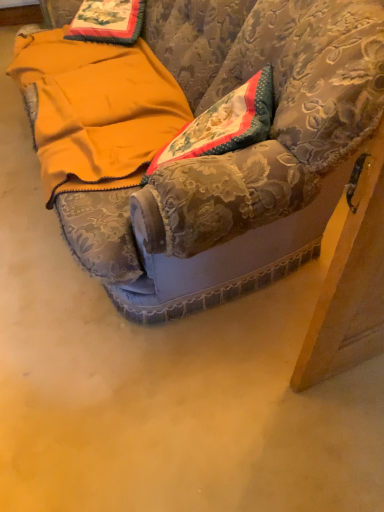
I want to click on yellow fleece blanket at lower left, so click(x=96, y=110).

This screenshot has height=512, width=384. Describe the element at coordinates (96, 110) in the screenshot. I see `yellow fleece blanket at lower left` at that location.

Describe the element at coordinates (240, 152) in the screenshot. I see `velvet couch at center` at that location.

Locate an element on the screen. velvet couch at center is located at coordinates (240, 152).

What is the approximate height of velvet couch at center?

The height of velvet couch at center is 96.11 centimeters.

This screenshot has width=384, height=512. In order to click on yellow fleece blanket at lower left in this screenshot , I will do `click(96, 110)`.

Does velvet couch at center appear on the left side of yellow fleece blanket at lower left?

No, velvet couch at center is not to the left of yellow fleece blanket at lower left.

From the picture: Is the position of velvet couch at center less distant than that of yellow fleece blanket at lower left?

A: Yes, the depth of velvet couch at center is less than that of yellow fleece blanket at lower left.

Does point (284, 73) lie in front of point (81, 100)?

Yes, it is in front of point (81, 100).

From the image's perspective, is velvet couch at center under yellow fleece blanket at lower left?

No, from the image's perspective, velvet couch at center is not beneath yellow fleece blanket at lower left.

From a real-world perspective, relative to yellow fleece blanket at lower left, is velvet couch at center vertically above or below?

velvet couch at center is situated higher than yellow fleece blanket at lower left in the real world.

Does velvet couch at center have a lesser width compared to yellow fleece blanket at lower left?

No.

Considering the sizes of objects velvet couch at center and yellow fleece blanket at lower left in the image provided, who is taller, velvet couch at center or yellow fleece blanket at lower left?

velvet couch at center is taller.

Considering the sizes of objects velvet couch at center and yellow fleece blanket at lower left in the image provided, who is bigger, velvet couch at center or yellow fleece blanket at lower left?

With larger size is velvet couch at center.

Is velvet couch at center completely or partially outside of yellow fleece blanket at lower left?

velvet couch at center is positioned outside yellow fleece blanket at lower left.

Are velvet couch at center and yellow fleece blanket at lower left located far from each other?

velvet couch at center is actually quite close to yellow fleece blanket at lower left.

Does velvet couch at center turn towards yellow fleece blanket at lower left?

Yes, velvet couch at center is facing yellow fleece blanket at lower left.

How many degrees apart are the facing directions of velvet couch at center and yellow fleece blanket at lower left?

2.55 degrees separate the facing orientations of velvet couch at center and yellow fleece blanket at lower left.

Locate an element on the screen. The width and height of the screenshot is (384, 512). furniture that is above the yellow fleece blanket at lower left (from a real-world perspective) is located at coordinates (240, 152).

Which is more to the left, yellow fleece blanket at lower left or velvet couch at center?

Positioned to the left is yellow fleece blanket at lower left.

Between yellow fleece blanket at lower left and velvet couch at center, which one is positioned in front?

velvet couch at center.

Is point (53, 138) less distant than point (213, 74)?

Yes.

From the image's perspective, would you say yellow fleece blanket at lower left is shown under velvet couch at center?

Yes, from the image's perspective, yellow fleece blanket at lower left is beneath velvet couch at center.

From a real-world perspective, relative to velvet couch at center, is yellow fleece blanket at lower left vertically above or below?

yellow fleece blanket at lower left is situated lower than velvet couch at center in the real world.

Does yellow fleece blanket at lower left have a lesser width compared to velvet couch at center?

Correct, the width of yellow fleece blanket at lower left is less than that of velvet couch at center.

Who is taller, yellow fleece blanket at lower left or velvet couch at center?

With more height is velvet couch at center.

In terms of size, does yellow fleece blanket at lower left appear bigger or smaller than velvet couch at center?

Clearly, yellow fleece blanket at lower left is smaller in size than velvet couch at center.

Is yellow fleece blanket at lower left situated inside velvet couch at center or outside?

yellow fleece blanket at lower left exists entirely within velvet couch at center.

Are yellow fleece blanket at lower left and velvet couch at center beside each other?

No.

Is yellow fleece blanket at lower left positioned with its back to velvet couch at center?

Yes, yellow fleece blanket at lower left is facing away from velvet couch at center.

Based on the photo, measure the distance from yellow fleece blanket at lower left to velvet couch at center.

32.89 centimeters.

Identify the location of furniture that appears above the yellow fleece blanket at lower left (from a real-world perspective). This screenshot has height=512, width=384. (240, 152).

This screenshot has width=384, height=512. Identify the location of blanket that appears below the velvet couch at center (from the image's perspective). (96, 110).

Find the location of `blanket directly beneath the velvet couch at center (from a real-world perspective)`. blanket directly beneath the velvet couch at center (from a real-world perspective) is located at coordinates (96, 110).